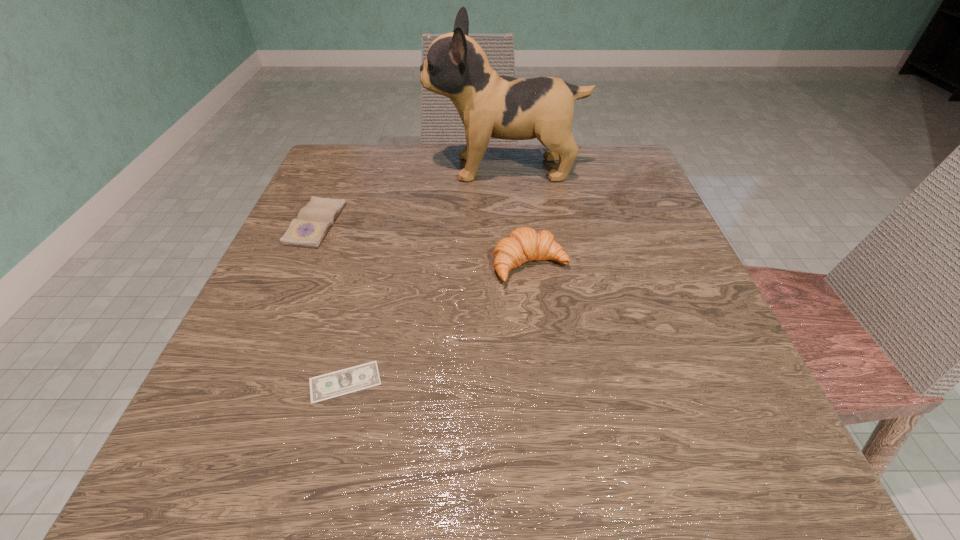
Where is `vacant space that is in between the farthest object and the nearest object`? vacant space that is in between the farthest object and the nearest object is located at coordinates (425, 275).

Locate an element on the screen. This screenshot has width=960, height=540. free space between the diary and the second object from left to right is located at coordinates (330, 303).

This screenshot has width=960, height=540. What are the coordinates of `unoccupied area between the crescent roll and the farthest object` in the screenshot? It's located at point(517,217).

The image size is (960, 540). I want to click on vacant area that lies between the crescent roll and the third object from right to left, so click(x=438, y=323).

The width and height of the screenshot is (960, 540). Find the location of `object that ranks as the third closest to the leftmost object`. object that ranks as the third closest to the leftmost object is located at coordinates (523, 244).

Identify which object is located as the second nearest to the farthest object. Please provide its 2D coordinates. Your answer should be formatted as a tuple, i.e. [(x, y)], where the tuple contains the x and y coordinates of a point satisfying the conditions above.

[(523, 244)]

The height and width of the screenshot is (540, 960). What are the coordinates of `free space that satisfies the following two spatial constraints: 1. at the face of the second tallest object; 2. on the right side of the tallest object` in the screenshot? It's located at (512, 265).

Where is `vacant region that satisfies the following two spatial constraints: 1. at the face of the puppy; 2. on the back side of the crescent roll`? vacant region that satisfies the following two spatial constraints: 1. at the face of the puppy; 2. on the back side of the crescent roll is located at coordinates (512, 265).

You are a GUI agent. You are given a task and a screenshot of the screen. Output one action in this format:
    pyautogui.click(x=<x>, y=<y>)
    Task: Click on the free location that satisfies the following two spatial constraints: 1. at the face of the crescent roll; 2. on the right side of the tallest object
    Image resolution: width=960 pixels, height=540 pixels.
    Given the screenshot: What is the action you would take?
    pyautogui.click(x=512, y=265)

The image size is (960, 540). I want to click on free space in the image that satisfies the following two spatial constraints: 1. at the face of the farthest object; 2. on the left side of the crescent roll, so click(512, 265).